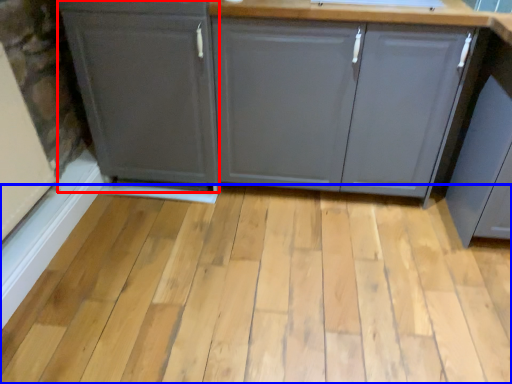
Question: Which point is closer to the camera, cabinetry (highlighted by a red box) or plank (highlighted by a blue box)?

Choices:
 (A) cabinetry
 (B) plank

Answer: (B)